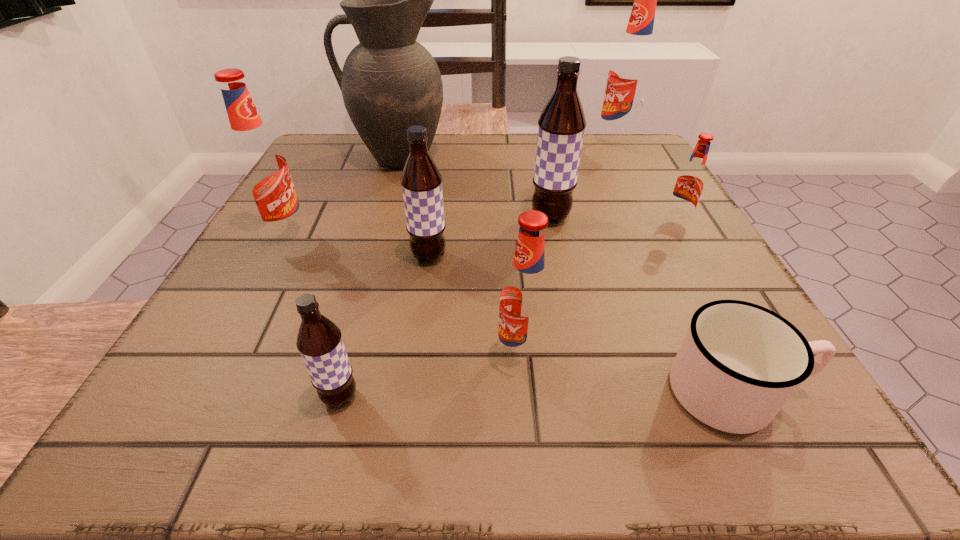
Where is `free space located 0.370m on the right of the second smallest brown root beer`? The image size is (960, 540). free space located 0.370m on the right of the second smallest brown root beer is located at coordinates (653, 256).

Where is `vacant space located 0.340m on the left of the nearest red root beer`? vacant space located 0.340m on the left of the nearest red root beer is located at coordinates (259, 356).

Where is `vacant space located 0.100m on the back of the smallest red root beer`? The image size is (960, 540). vacant space located 0.100m on the back of the smallest red root beer is located at coordinates (659, 188).

The height and width of the screenshot is (540, 960). I want to click on free space located 0.380m on the right of the nearest root beer, so click(x=649, y=397).

Where is `root beer that is at the far edge`? The image size is (960, 540). root beer that is at the far edge is located at coordinates (631, 70).

Where is `pitcher positioned at the far edge`? The image size is (960, 540). pitcher positioned at the far edge is located at coordinates (389, 82).

Find the location of a particular element. Image resolution: width=960 pixels, height=540 pixels. root beer that is at the near edge is located at coordinates (319, 341).

In order to click on mug that is at the near edge in this screenshot , I will do `click(739, 363)`.

The width and height of the screenshot is (960, 540). I want to click on pitcher that is at the left edge, so click(389, 82).

The width and height of the screenshot is (960, 540). What are the coordinates of `root beer present at the left edge` in the screenshot? It's located at (260, 165).